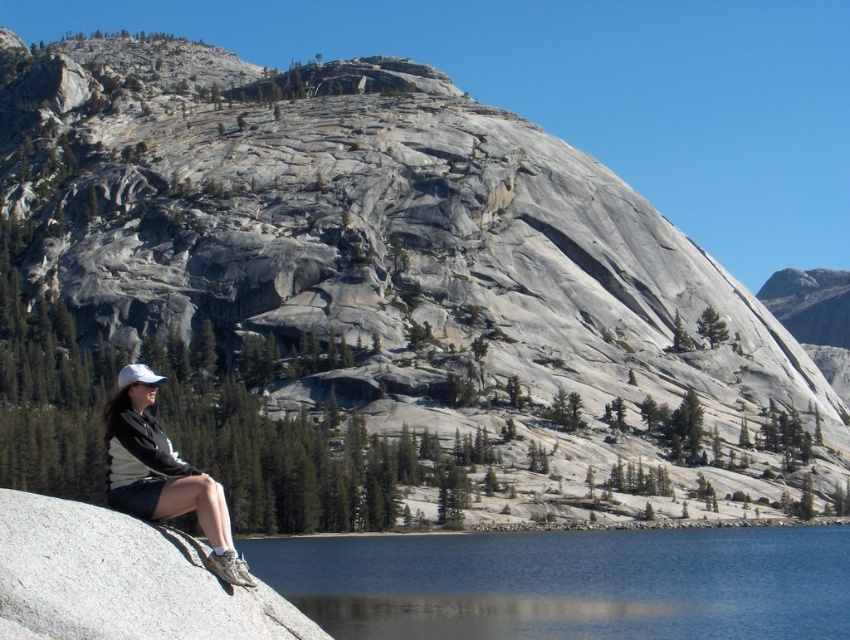
Is blue glassy water at lower center wider than white matte baseball cap at lower left?

Correct, the width of blue glassy water at lower center exceeds that of white matte baseball cap at lower left.

Which of these two, blue glassy water at lower center or white matte baseball cap at lower left, stands shorter?

blue glassy water at lower center is shorter.

Where is `blue glassy water at lower center`? Image resolution: width=850 pixels, height=640 pixels. blue glassy water at lower center is located at coordinates (568, 582).

Locate an element on the screen. The width and height of the screenshot is (850, 640). blue glassy water at lower center is located at coordinates [x=568, y=582].

Measure the distance between point (163,616) and camera.

Point (163,616) and camera are 41.98 meters apart.

Does point (51, 516) come in front of point (208, 488)?

Yes, point (51, 516) is in front of point (208, 488).

This screenshot has height=640, width=850. What do you see at coordinates (122, 580) in the screenshot?
I see `gray granite boulder at lower left` at bounding box center [122, 580].

Find the location of `gray granite boulder at lower left`. gray granite boulder at lower left is located at coordinates (122, 580).

Is blue glassy water at lower center shorter than gray granite boulder at lower left?

Correct, blue glassy water at lower center is not as tall as gray granite boulder at lower left.

Does blue glassy water at lower center have a lesser width compared to gray granite boulder at lower left?

No.

Between point (514, 616) and point (178, 570), which one is positioned in front?

Positioned in front is point (178, 570).

Find the location of `blue glassy water at lower center`. blue glassy water at lower center is located at coordinates (568, 582).